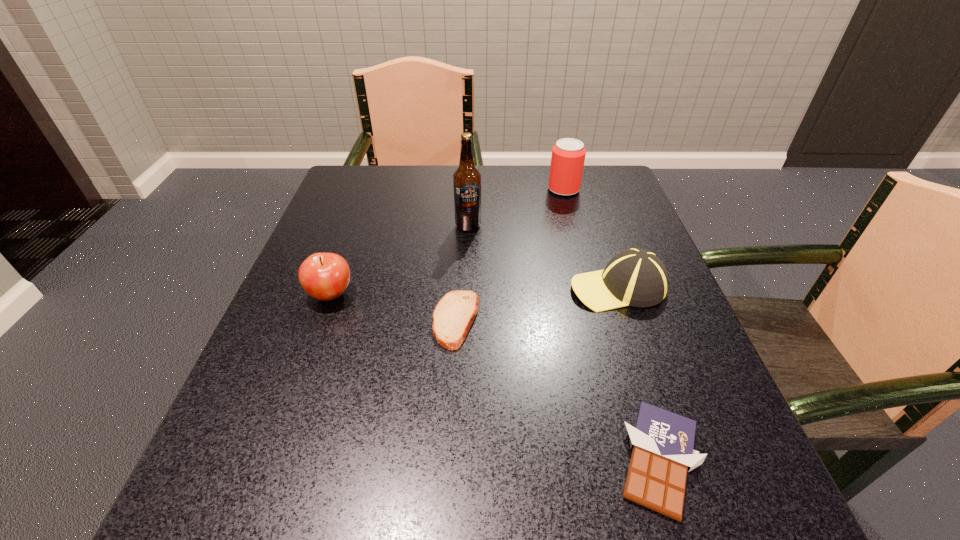
Where is `vacant position located 0.200m on the back of the leftmost object`? Image resolution: width=960 pixels, height=540 pixels. vacant position located 0.200m on the back of the leftmost object is located at coordinates (357, 222).

Identify the location of blank space located 0.380m with the brim of the fourth tallest object facing forward. (379, 287).

This screenshot has height=540, width=960. Identify the location of free space located 0.340m with the brim of the fourth tallest object facing forward. (399, 287).

Find the location of `free space located with the brim of the fourth tallest object facing forward`. free space located with the brim of the fourth tallest object facing forward is located at coordinates (424, 287).

I want to click on vacant position located 0.070m on the front of the pita bread, so click(x=452, y=386).

Find the location of a particular element. Image resolution: width=960 pixels, height=540 pixels. blank space located 0.220m on the back of the chocolate bar is located at coordinates (612, 306).

Locate an element on the screen. object that is at the far edge is located at coordinates (568, 155).

You are a GUI agent. You are given a task and a screenshot of the screen. Output one action in this format:
    pyautogui.click(x=<x>, y=<y>)
    Task: Click on the object present at the near edge
    The height and width of the screenshot is (540, 960).
    Given the screenshot: What is the action you would take?
    pyautogui.click(x=662, y=442)

Locate an element on the screen. The image size is (960, 540). object at the left edge is located at coordinates (324, 276).

Find the location of a particular element. beer can present at the right edge is located at coordinates (568, 155).